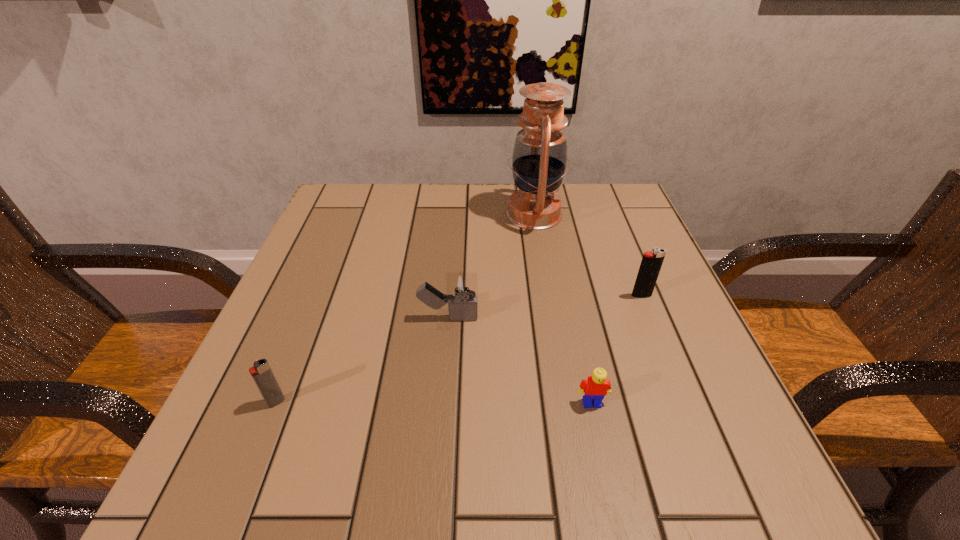
The height and width of the screenshot is (540, 960). I want to click on free space between the Lego and the leftmost igniter, so click(434, 402).

Where is `vacant space in between the second igniter from left to right and the Lego`? vacant space in between the second igniter from left to right and the Lego is located at coordinates (520, 360).

The width and height of the screenshot is (960, 540). Find the location of `blank region between the shortest object and the nearest igniter`. blank region between the shortest object and the nearest igniter is located at coordinates (434, 402).

Find the location of a particular element. free point between the second igniter from right to left and the Lego is located at coordinates (520, 360).

Find the location of a particular element. The height and width of the screenshot is (540, 960). object that is the fourth closest to the farthest igniter is located at coordinates (261, 372).

Find the location of a particular element. The width and height of the screenshot is (960, 540). object that is the third nearest to the Lego is located at coordinates (539, 158).

Find the location of a particular element. Image resolution: width=960 pixels, height=540 pixels. the closest igniter to the leftmost igniter is located at coordinates (462, 290).

Point out which igniter is positioned as the nearest to the rightmost object. Please provide its 2D coordinates. Your answer should be formatted as a tuple, i.e. [(x, y)], where the tuple contains the x and y coordinates of a point satisfying the conditions above.

[(462, 290)]

Locate an element on the screen. This screenshot has height=540, width=960. vacant position in the image that satisfies the following two spatial constraints: 1. on the back side of the shortest igniter; 2. on the right side of the oil lamp is located at coordinates (351, 214).

At what (x,y) coordinates should I click in order to perform the action: click on free location that satisfies the following two spatial constraints: 1. on the back side of the leftmost igniter; 2. on the right side of the oil lamp. Please return your answer as a coordinate pair (x, y). Looking at the image, I should click on (351, 214).